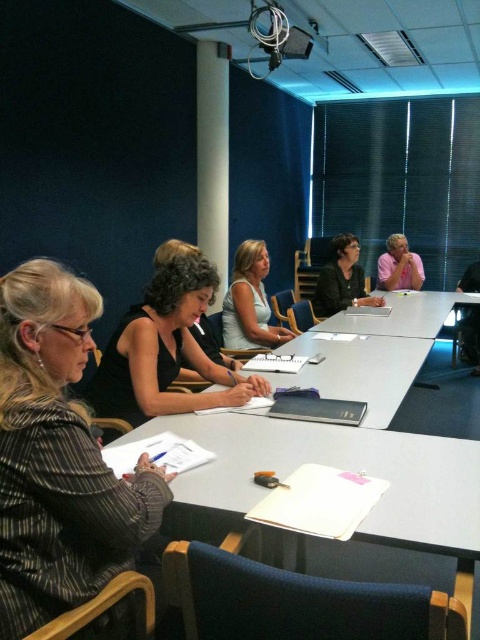
Question: Can you confirm if white paper at center is positioned above light blue fabric shirt at center?

Choices:
 (A) no
 (B) yes

Answer: (A)

Question: Which point appears farthest from the camera in this image?

Choices:
 (A) (379, 275)
 (B) (417, 440)

Answer: (A)

Question: Estimate the real-world distances between objects in this image. Which object is farther from the matte black shirt at center?

Choices:
 (A) smooth gray table at center
 (B) black fabric jacket at center

Answer: (B)

Question: Can you confirm if light blue fabric shirt at center is positioned to the left of black fabric jacket at center?

Choices:
 (A) yes
 (B) no

Answer: (A)

Question: Which of the following is the closest to the observer?

Choices:
 (A) pink matte shirt at upper right
 (B) light blue fabric shirt at center
 (C) white paper at center
 (D) striped fabric jacket at left

Answer: (D)

Question: Can you confirm if white paper at center is positioned to the right of smooth gray table at center?

Choices:
 (A) no
 (B) yes

Answer: (A)